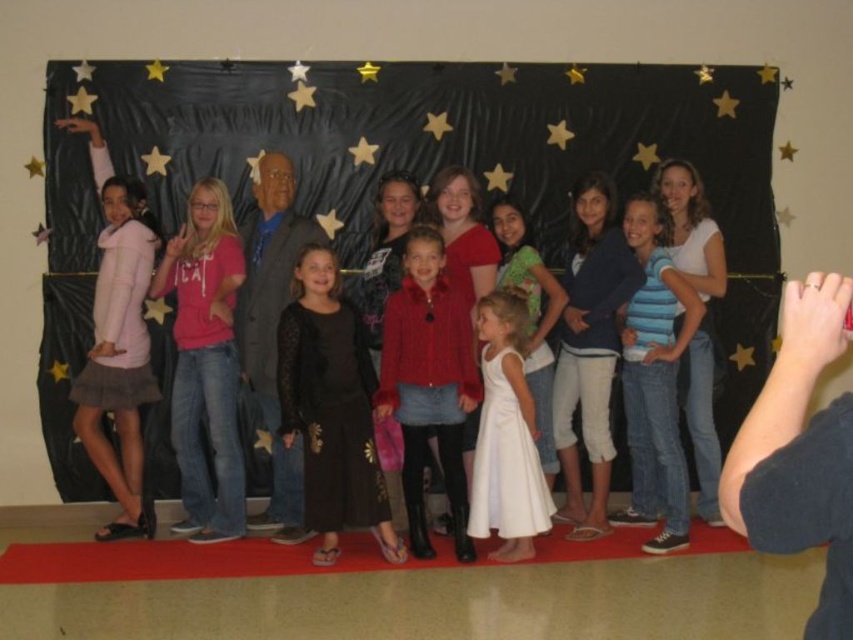
Can you confirm if matte red sweater at center is positioned below white satin dress at center?

Incorrect, matte red sweater at center is not positioned below white satin dress at center.

Can you confirm if matte red sweater at center is taller than white satin dress at center?

Yes.

Is point (444, 410) positioned before point (535, 531)?

No, it is not.

You are a GUI agent. You are given a task and a screenshot of the screen. Output one action in this format:
    pyautogui.click(x=<x>, y=<y>)
    Task: Click on the matte red sweater at center
    This screenshot has width=853, height=640.
    Given the screenshot: What is the action you would take?
    pyautogui.click(x=428, y=381)

Can you confirm if pink cotton shirt at center is positioned above white satin dress at center?

Yes.

This screenshot has width=853, height=640. What are the coordinates of `pink cotton shirt at center` in the screenshot? It's located at (206, 362).

Locate an element on the screen. This screenshot has width=853, height=640. pink cotton shirt at center is located at coordinates (206, 362).

How far apart are blue striped shirt at center and white satin dress at center?

They are 31.83 inches apart.

Is point (646, 218) in front of point (471, 525)?

No, it is not.

Where is `blue striped shirt at center`? The image size is (853, 640). blue striped shirt at center is located at coordinates (654, 380).